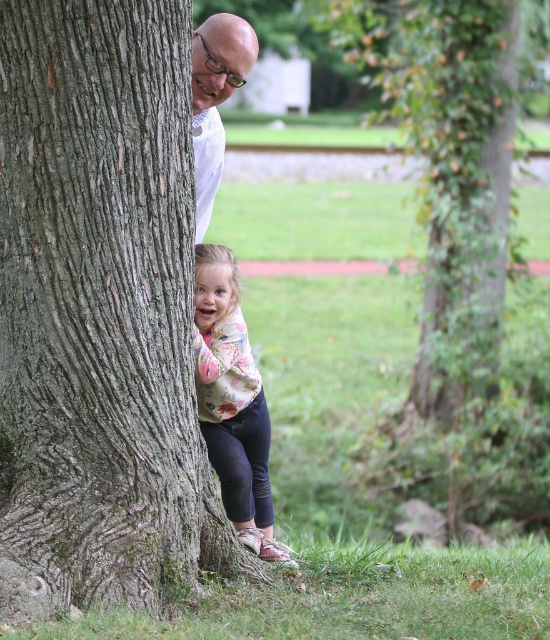
Question: Among these points, which one is farthest from the camera?

Choices:
 (A) (481, 392)
 (B) (145, 380)
 (C) (211, 156)
 (D) (195, 380)

Answer: (A)

Question: Which point is farther to the camera?

Choices:
 (A) (226, 300)
 (B) (514, 24)
 (C) (82, 566)
 (D) (223, 93)

Answer: (B)

Question: Which is farther from the floral sweater at lower center?

Choices:
 (A) white matte shirt at upper center
 (B) green ivy-covered tree at center
 (C) smooth brown tree trunk at left

Answer: (B)

Question: Is smooth brown tree trunk at left above green ivy-covered tree at center?

Choices:
 (A) yes
 (B) no

Answer: (B)

Question: In this image, where is green ivy-covered tree at center located relative to floral sweater at lower center?

Choices:
 (A) above
 (B) below

Answer: (A)

Question: Does smooth brown tree trunk at left appear on the left side of white matte shirt at upper center?

Choices:
 (A) no
 (B) yes

Answer: (B)